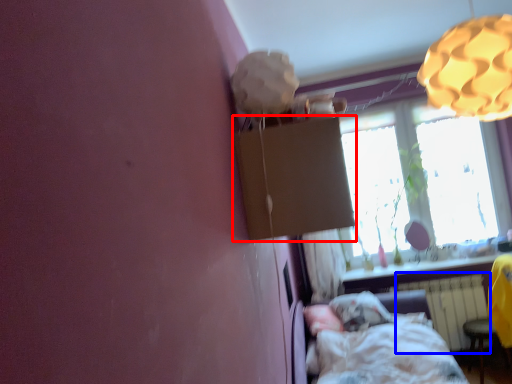
Question: Which object is closer to the camera taking this photo, cardboard box (highlighted by a red box) or radiator (highlighted by a blue box)?

Choices:
 (A) cardboard box
 (B) radiator

Answer: (A)